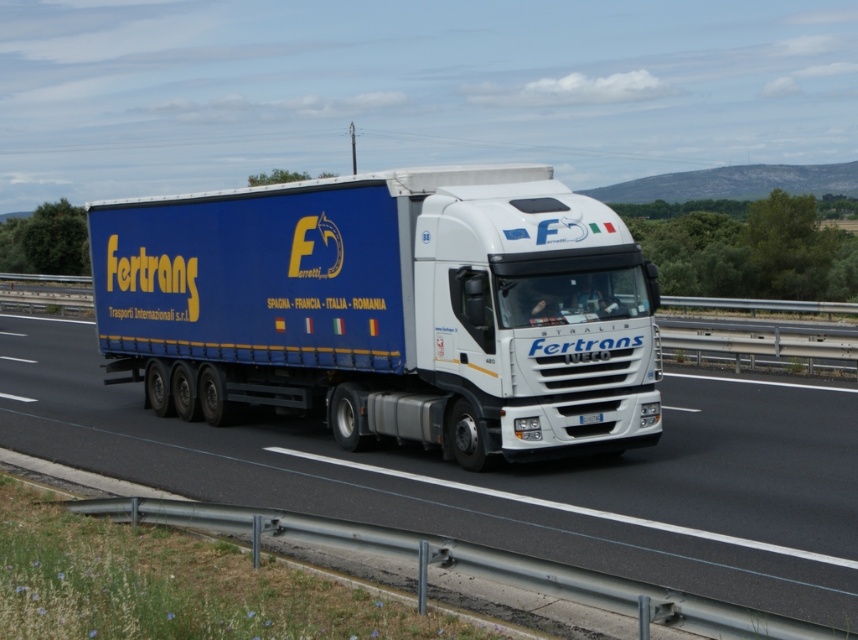
Between blue matte trailer truck at center and white glossy truck at center, which one is positioned higher?

blue matte trailer truck at center is higher up.

Does point (349, 449) come closer to viewer compared to point (142, 424)?

That is True.

The width and height of the screenshot is (858, 640). I want to click on blue matte trailer truck at center, so click(x=390, y=308).